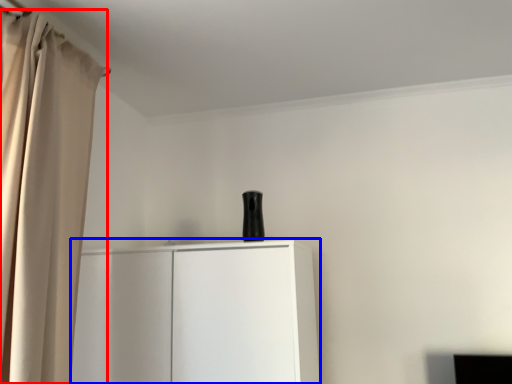
Question: Which object is closer to the camera taking this photo, curtain (highlighted by a red box) or cupboard (highlighted by a blue box)?

Choices:
 (A) curtain
 (B) cupboard

Answer: (A)